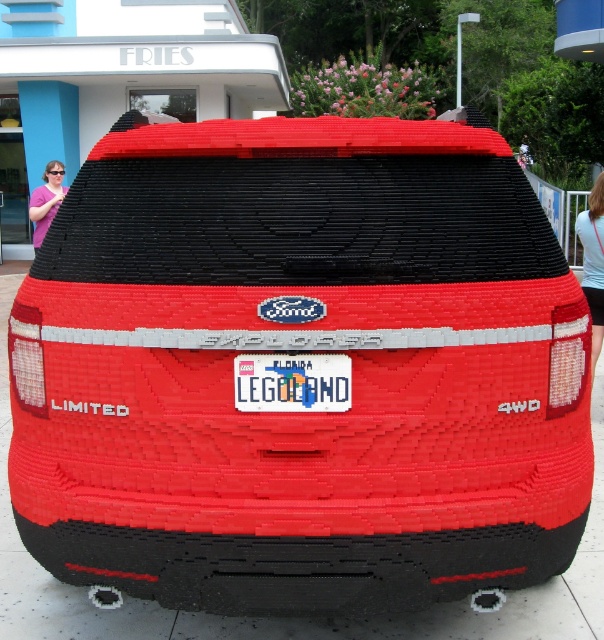
Question: Which object is closer to the camera taking this photo?

Choices:
 (A) pink fabric sunglasses at left
 (B) white plastic license plate at center

Answer: (B)

Question: Is the position of blue denim shorts at lower right more distant than that of pink fabric sunglasses at left?

Choices:
 (A) no
 (B) yes

Answer: (A)

Question: Is white plastic license plate at center thinner than pink fabric sunglasses at left?

Choices:
 (A) yes
 (B) no

Answer: (B)

Question: Which object is closer to the camera taking this photo?

Choices:
 (A) pink fabric sunglasses at left
 (B) blue denim shorts at lower right

Answer: (B)

Question: Does blue denim shorts at lower right appear on the left side of pink fabric sunglasses at left?

Choices:
 (A) no
 (B) yes

Answer: (A)

Question: Which object appears farthest from the camera in this image?

Choices:
 (A) pink fabric sunglasses at left
 (B) white plastic license plate at center

Answer: (A)